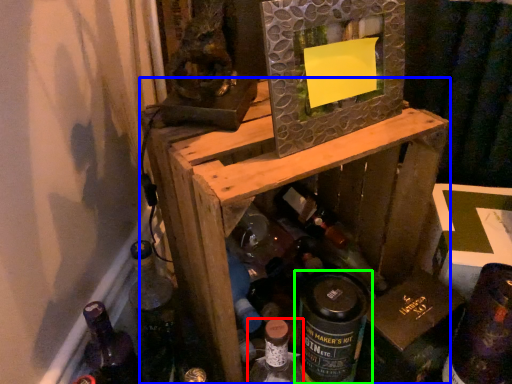
Question: Which is farther away from bottle (highlighted by a red box)? furniture (highlighted by a blue box) or bottle (highlighted by a green box)?

Choices:
 (A) furniture
 (B) bottle

Answer: (A)